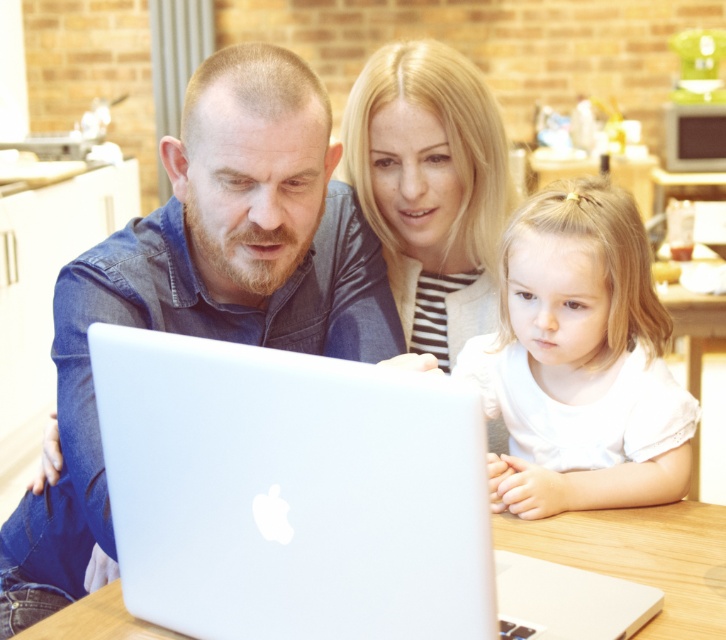
Who is positioned more to the left, matte blue shirt at center or white matte shirt at lower right?

Positioned to the left is matte blue shirt at center.

Describe the element at coordinates (203, 291) in the screenshot. I see `matte blue shirt at center` at that location.

Find the location of a particular element. matte blue shirt at center is located at coordinates (203, 291).

Which is behind, point (330, 294) or point (415, 184)?

Positioned behind is point (415, 184).

Is point (76, 392) positioned before point (364, 118)?

Yes, point (76, 392) is in front of point (364, 118).

The height and width of the screenshot is (640, 726). I want to click on matte blue shirt at center, so click(203, 291).

Locate an element on the screen. This screenshot has height=640, width=726. matte blue shirt at center is located at coordinates (203, 291).

Does blonde hair at upper center have a greater width compared to white wooden table at center?

Indeed, blonde hair at upper center has a greater width compared to white wooden table at center.

How distant is blonde hair at upper center from white wooden table at center?

blonde hair at upper center is 23.65 inches from white wooden table at center.

This screenshot has height=640, width=726. What do you see at coordinates (431, 188) in the screenshot?
I see `blonde hair at upper center` at bounding box center [431, 188].

Locate an element on the screen. Image resolution: width=726 pixels, height=640 pixels. blonde hair at upper center is located at coordinates (431, 188).